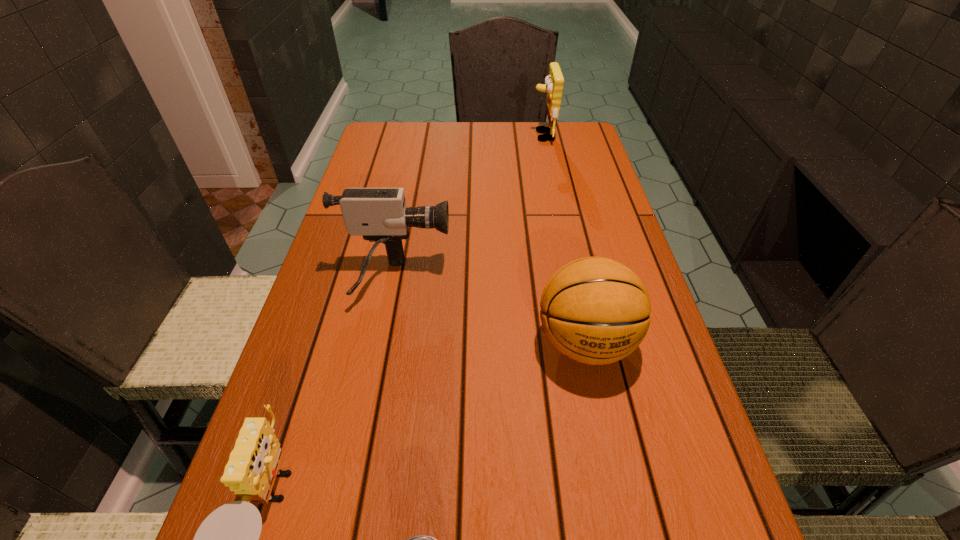
Find the location of a particular element. This screenshot has height=540, width=960. object located in the left edge section of the desktop is located at coordinates (380, 215).

Image resolution: width=960 pixels, height=540 pixels. In order to click on sponge positioned at the right edge in this screenshot , I will do `click(553, 84)`.

This screenshot has height=540, width=960. In order to click on basketball at the right edge in this screenshot , I will do `click(594, 310)`.

Image resolution: width=960 pixels, height=540 pixels. Find the location of `object present at the far right corner`. object present at the far right corner is located at coordinates (553, 84).

Locate an element on the screen. This screenshot has height=540, width=960. vacant space at the far edge of the desktop is located at coordinates [477, 125].

I want to click on free space at the left edge of the desktop, so click(x=401, y=166).

This screenshot has height=540, width=960. Identify the location of vacant space at the right edge of the desktop. (x=556, y=199).

At what (x,y) coordinates should I click in order to perform the action: click on the closest object to the shortest object. Please return your answer as a coordinate pair (x, y). Looking at the image, I should click on (227, 539).

Where is `the fourth closest object relative to the basketball`? This screenshot has width=960, height=540. the fourth closest object relative to the basketball is located at coordinates (553, 84).